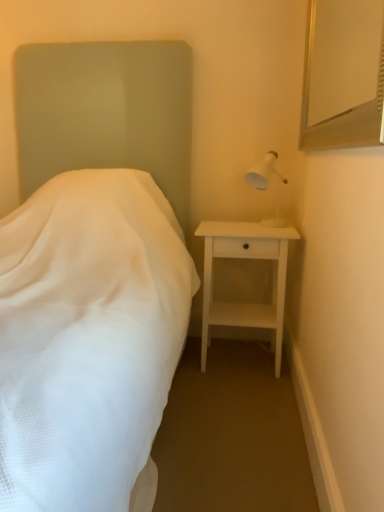
Question: Can you confirm if white plastic lamp at upper right is thinner than white fabric bed at left?

Choices:
 (A) yes
 (B) no

Answer: (A)

Question: From a real-world perspective, does white plastic lamp at upper right sit lower than white fabric bed at left?

Choices:
 (A) yes
 (B) no

Answer: (B)

Question: From a real-world perspective, is white plastic lamp at upper right on top of white fabric bed at left?

Choices:
 (A) no
 (B) yes

Answer: (B)

Question: Does white plastic lamp at upper right contain white fabric bed at left?

Choices:
 (A) no
 (B) yes

Answer: (A)

Question: Could you tell me if white plastic lamp at upper right is facing white fabric bed at left?

Choices:
 (A) no
 (B) yes

Answer: (A)

Question: Based on their sizes in the image, would you say white matte nightstand at right is bigger or smaller than white plastic lamp at upper right?

Choices:
 (A) big
 (B) small

Answer: (A)

Question: Considering the positions of white matte nightstand at right and white plastic lamp at upper right in the image, is white matte nightstand at right wider or thinner than white plastic lamp at upper right?

Choices:
 (A) wide
 (B) thin

Answer: (A)

Question: Is white matte nightstand at right taller or shorter than white plastic lamp at upper right?

Choices:
 (A) short
 (B) tall

Answer: (B)

Question: Visually, is white matte nightstand at right positioned to the left or to the right of white plastic lamp at upper right?

Choices:
 (A) right
 (B) left

Answer: (B)

Question: In terms of size, does white plastic lamp at upper right appear bigger or smaller than white matte nightstand at right?

Choices:
 (A) big
 (B) small

Answer: (B)

Question: Considering the positions of point (266, 184) and point (261, 321), is point (266, 184) closer or farther from the camera than point (261, 321)?

Choices:
 (A) closer
 (B) farther

Answer: (B)

Question: Visually, is white plastic lamp at upper right positioned to the left or to the right of white matte nightstand at right?

Choices:
 (A) right
 (B) left

Answer: (A)

Question: Would you say white plastic lamp at upper right is inside or outside white matte nightstand at right?

Choices:
 (A) outside
 (B) inside

Answer: (A)

Question: Does point (102, 181) appear closer or farther from the camera than point (266, 159)?

Choices:
 (A) farther
 (B) closer

Answer: (B)

Question: Is white fabric bed at left spatially inside white plastic lamp at upper right, or outside of it?

Choices:
 (A) inside
 (B) outside

Answer: (B)